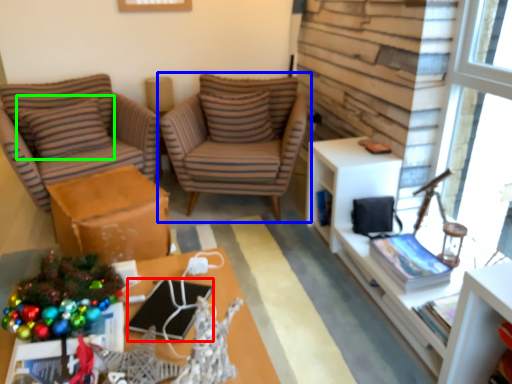
Question: Estimate the real-world distances between objects in this image. Which object is closer to laptop (highlighted by a red box), chair (highlighted by a blue box) or pillow (highlighted by a green box)?

Choices:
 (A) chair
 (B) pillow

Answer: (A)